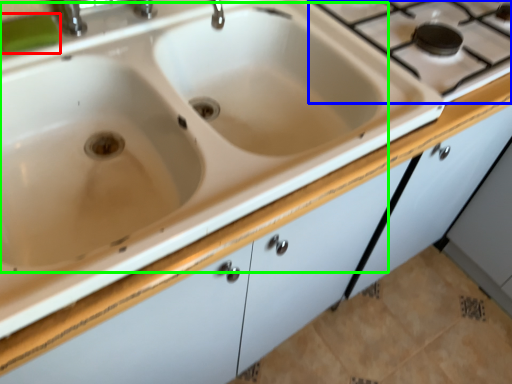
Question: Which object is positioned farthest from soap (highlighted by a red box)? Select from gas stove (highlighted by a blue box) and sink (highlighted by a green box).

Choices:
 (A) gas stove
 (B) sink

Answer: (A)